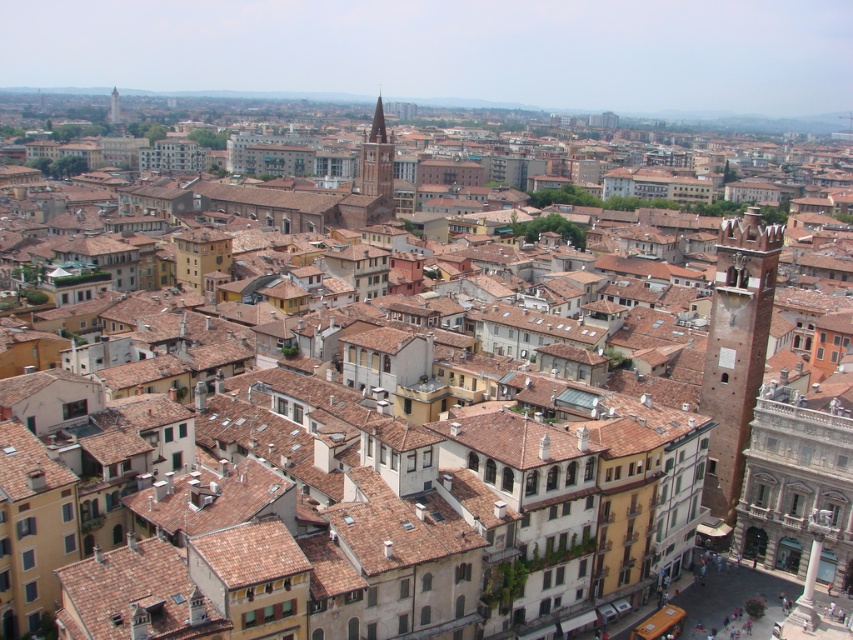
Does brick tower at right come behind smooth stone tower at center?

No, it is in front of smooth stone tower at center.

Does brick tower at right appear under smooth stone tower at center?

Yes.

I want to click on brick tower at right, so click(735, 349).

Is smooth stone tower at center to the right of light brown stone tower at upper center from the viewer's perspective?

Yes, smooth stone tower at center is to the right of light brown stone tower at upper center.

Is point (380, 120) more distant than point (114, 93)?

No, (380, 120) is closer to viewer.

Does point (375, 108) come in front of point (119, 113)?

Yes, point (375, 108) is closer to viewer.

Find the location of `smooth stone tower at center`. smooth stone tower at center is located at coordinates (376, 157).

Measure the distance between point [732,470] and camera.

Point [732,470] and camera are 120.16 meters apart from each other.

Consider the image. Is the position of brick tower at right more distant than that of light brown stone tower at upper center?

No, brick tower at right is in front of light brown stone tower at upper center.

Which is in front, point (723, 400) or point (113, 108)?

Point (723, 400) is in front.

This screenshot has width=853, height=640. What are the coordinates of `brick tower at right` in the screenshot? It's located at (735, 349).